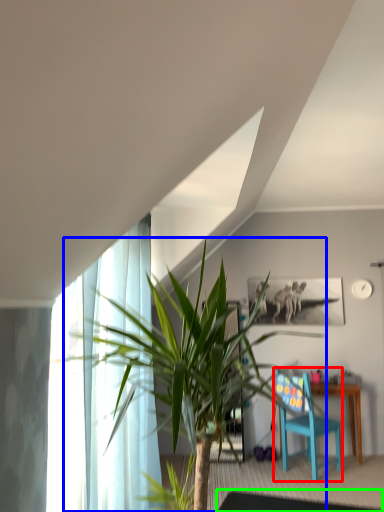
Question: Which is farther away from chair (highlighted by a red box)? houseplant (highlighted by a blue box) or glass table (highlighted by a green box)?

Choices:
 (A) houseplant
 (B) glass table

Answer: (A)